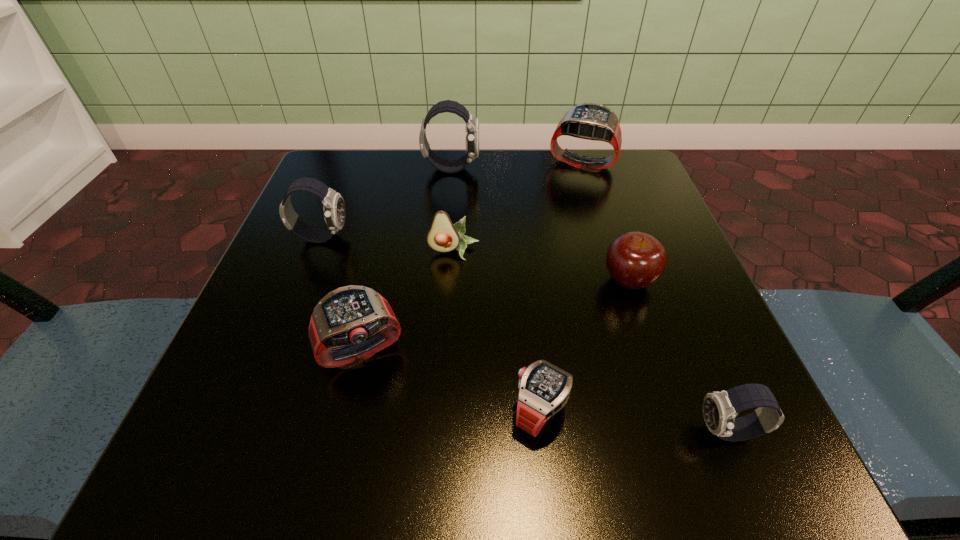
I want to click on the tallest object, so click(472, 124).

You are a GUI agent. You are given a task and a screenshot of the screen. Output one action in this format:
    pyautogui.click(x=<x>, y=<y>)
    Task: Click on the second dark watch from left to right
    The height and width of the screenshot is (540, 960).
    Given the screenshot: What is the action you would take?
    pyautogui.click(x=472, y=124)

Where is `the biggest red watch`? the biggest red watch is located at coordinates (592, 121).

Locate an element on the screen. This screenshot has width=960, height=540. the farthest red watch is located at coordinates (592, 121).

Where is `the leftmost watch`? This screenshot has width=960, height=540. the leftmost watch is located at coordinates (334, 208).

Identify the location of the second smallest dark watch. point(334,208).

Identify the location of the second farthest red watch. coord(350,324).

Locate an element on the screen. The height and width of the screenshot is (540, 960). the sixth farthest object is located at coordinates (350, 324).

You are a GUI agent. You are given a task and a screenshot of the screen. Output one action in this format:
    pyautogui.click(x=<x>, y=<y>)
    Task: Click on the fifth farthest object
    This screenshot has height=540, width=960.
    Given the screenshot: What is the action you would take?
    pyautogui.click(x=635, y=260)

Locate an element on the screen. The height and width of the screenshot is (540, 960). red apple is located at coordinates coord(635,260).